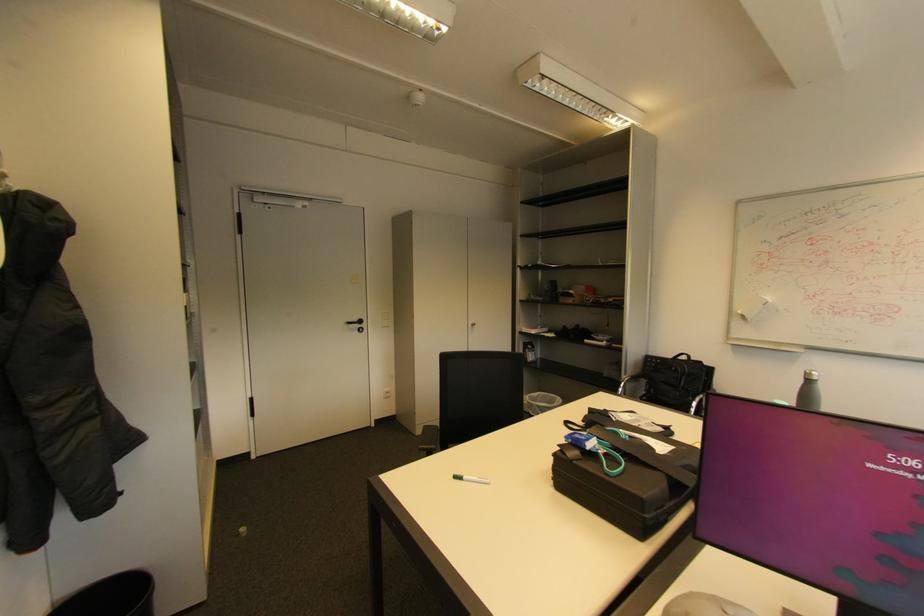
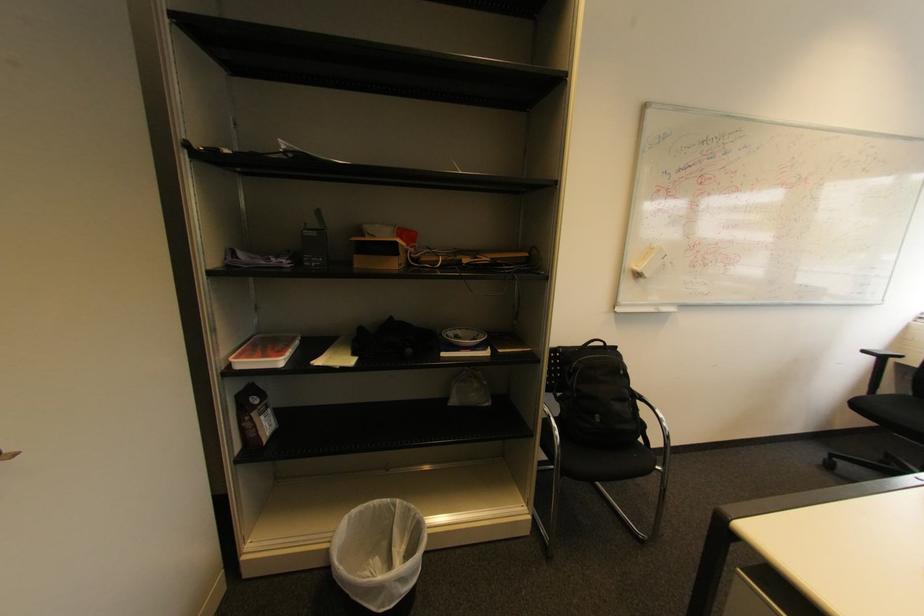
The point at (698, 360) is marked in the first image. Where is the corresponding point in the second image?

(613, 345)